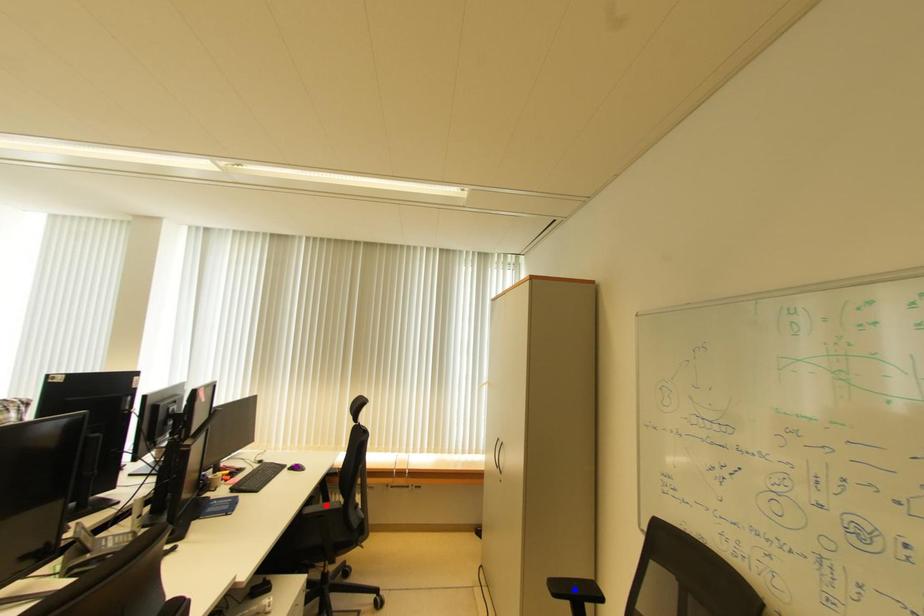
From the picture: Order these from farthest to nearest:
purple point
red point
blue point

purple point < red point < blue point